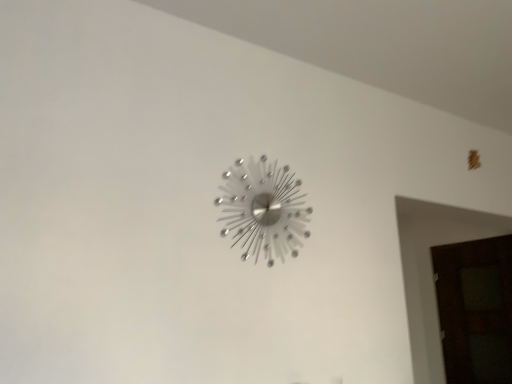
Question: Could you tell me if dark wood door at right is turned towards silver metallic wall clock at center?

Choices:
 (A) no
 (B) yes

Answer: (B)

Question: Is dark wood door at right bigger than silver metallic wall clock at center?

Choices:
 (A) no
 (B) yes

Answer: (B)

Question: Considering the relative positions of dark wood door at right and silver metallic wall clock at center in the image provided, is dark wood door at right to the left of silver metallic wall clock at center from the viewer's perspective?

Choices:
 (A) no
 (B) yes

Answer: (A)

Question: Considering the relative positions of dark wood door at right and silver metallic wall clock at center in the image provided, is dark wood door at right to the right of silver metallic wall clock at center from the viewer's perspective?

Choices:
 (A) no
 (B) yes

Answer: (B)

Question: From a real-world perspective, is dark wood door at right on top of silver metallic wall clock at center?

Choices:
 (A) yes
 (B) no

Answer: (B)

Question: Is dark wood door at right wider than silver metallic wall clock at center?

Choices:
 (A) no
 (B) yes

Answer: (B)

Question: Is silver metallic wall clock at center outside dark wood door at right?

Choices:
 (A) no
 (B) yes

Answer: (B)

Question: Is silver metallic wall clock at center thinner than dark wood door at right?

Choices:
 (A) yes
 (B) no

Answer: (A)

Question: Is silver metallic wall clock at center smaller than dark wood door at right?

Choices:
 (A) no
 (B) yes

Answer: (B)

Question: From a real-world perspective, is silver metallic wall clock at center on top of dark wood door at right?

Choices:
 (A) yes
 (B) no

Answer: (A)

Question: Is the position of silver metallic wall clock at center more distant than that of dark wood door at right?

Choices:
 (A) no
 (B) yes

Answer: (A)

Question: Does silver metallic wall clock at center have a greater width compared to dark wood door at right?

Choices:
 (A) no
 (B) yes

Answer: (A)

Question: In the image, is dark wood door at right positioned in front of or behind silver metallic wall clock at center?

Choices:
 (A) behind
 (B) front

Answer: (A)